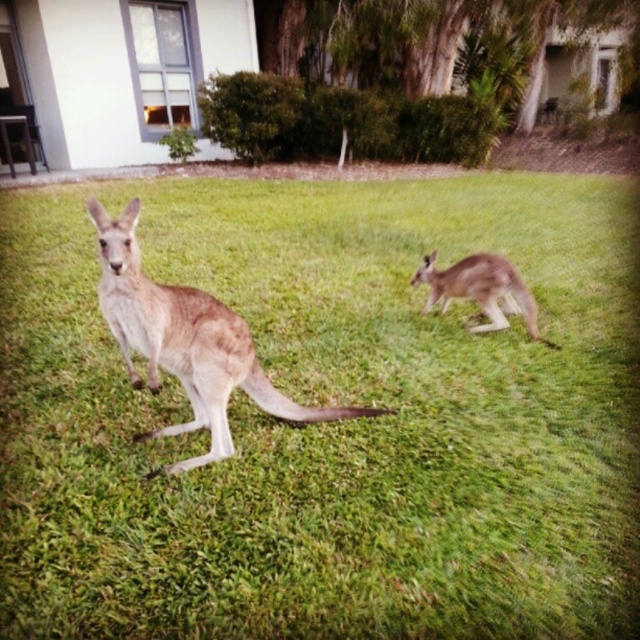
Question: Is brown fur kangaroo at center further to camera compared to light brown fur kangaroo at right?

Choices:
 (A) yes
 (B) no

Answer: (B)

Question: Is light brown fur kangaroo at center behind light brown fur kangaroo at right?

Choices:
 (A) yes
 (B) no

Answer: (B)

Question: Can you confirm if brown fur kangaroo at center is thinner than light brown fur kangaroo at right?

Choices:
 (A) yes
 (B) no

Answer: (B)

Question: Which point appears closest to the camera in this image?

Choices:
 (A) (131, 316)
 (B) (316, 634)
 (C) (467, 259)

Answer: (B)

Question: Which object is the closest to the light brown fur kangaroo at right?

Choices:
 (A) light brown fur kangaroo at center
 (B) brown fur kangaroo at center

Answer: (B)

Question: Which object is farther from the camera taking this photo?

Choices:
 (A) brown fur kangaroo at center
 (B) light brown fur kangaroo at right
 (C) light brown fur kangaroo at center

Answer: (B)